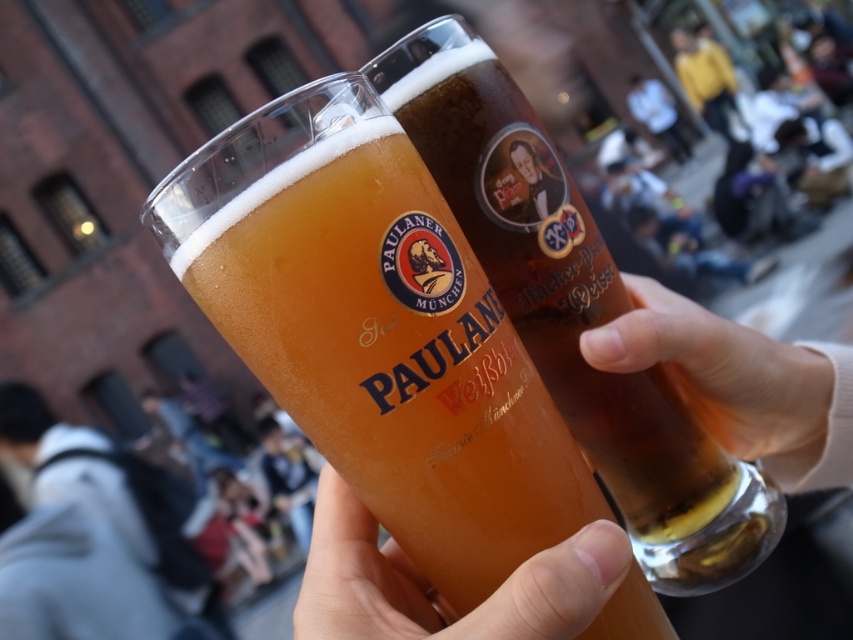
You are at a social event and want to pour a drink into the taller glass. Which one should you choose between the translucent glass beer glass at center and the translucent glass at center?

The translucent glass beer glass at center is taller than the translucent glass at center, so you should choose the translucent glass beer glass at center.